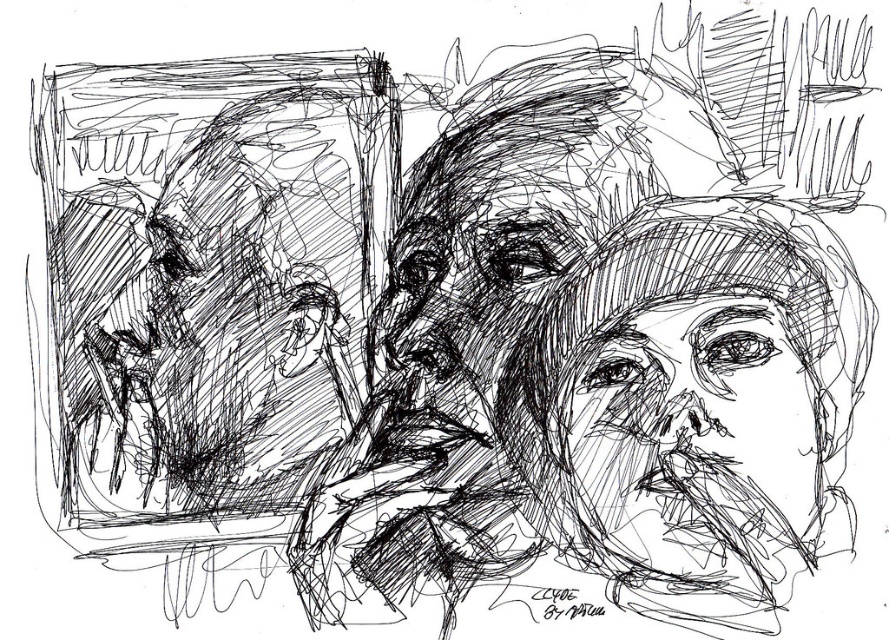
Based on the scene description, can you determine which object is layered on top of the other between the black ink sketch of face at center and the smooth black face at center?

The black ink sketch of face at center is positioned over the smooth black face at center, so it is layered on top.

Looking at the monochromatic sketch, which object is positioned to the right of the other between the black ink sketch of face at center and the smooth black face at center?

The black ink sketch of face at center is positioned to the right of the smooth black face at center.

What is the significance of the point at coordinates (683, 401) in the monochromatic sketch?

The point at coordinates (683, 401) indicates the black ink sketch of face at center.